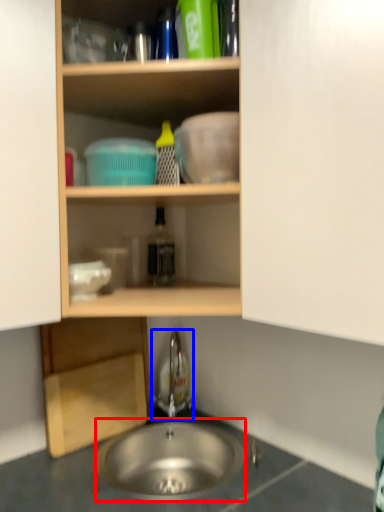
Question: Which object appears farthest to the camera in this image, sink (highlighted by a red box) or faucet (highlighted by a blue box)?

Choices:
 (A) sink
 (B) faucet

Answer: (B)